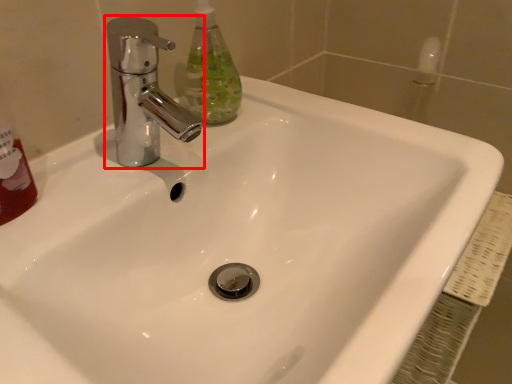
Question: From the image, what is the correct spatial relationship of tap (annotated by the red box) in relation to cleaning product?

Choices:
 (A) right
 (B) left

Answer: (B)